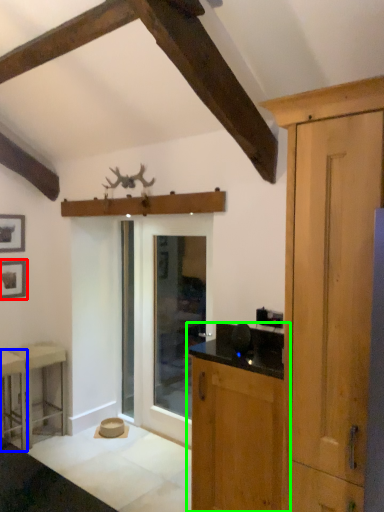
Question: Which object is the closest to the picture frame (highlighted by a red box)? Choose among these: stool (highlighted by a blue box) or cabinetry (highlighted by a green box).

Choices:
 (A) stool
 (B) cabinetry

Answer: (A)